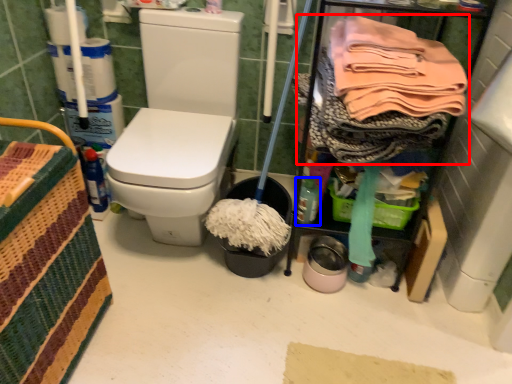
Question: Among these objects, which one is nearest to the camera, clothing (highlighted by a red box) or bottle (highlighted by a blue box)?

Choices:
 (A) clothing
 (B) bottle

Answer: (A)